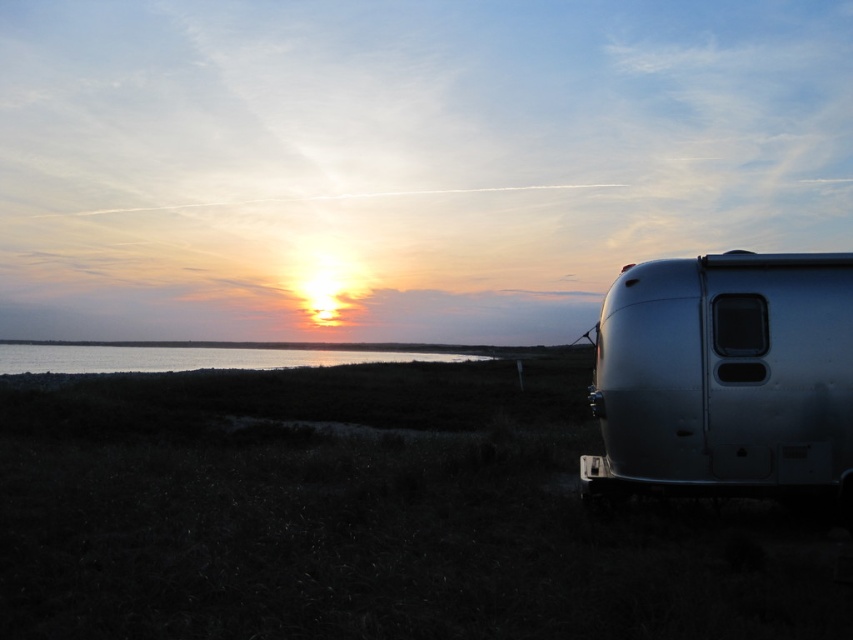
Question: Is silver metallic trailer at right positioned behind silvery reflective water at lower left?

Choices:
 (A) yes
 (B) no

Answer: (B)

Question: Can you confirm if silver metallic trailer at right is thinner than silvery reflective water at lower left?

Choices:
 (A) no
 (B) yes

Answer: (B)

Question: Is silver metallic trailer at right closer to the viewer compared to silvery reflective water at lower left?

Choices:
 (A) no
 (B) yes

Answer: (B)

Question: Which of the following is the farthest from the observer?

Choices:
 (A) silvery reflective water at lower left
 (B) silver metallic trailer at right

Answer: (A)

Question: Which point appears farthest from the camera in this image?

Choices:
 (A) (756, 394)
 (B) (438, 356)

Answer: (B)